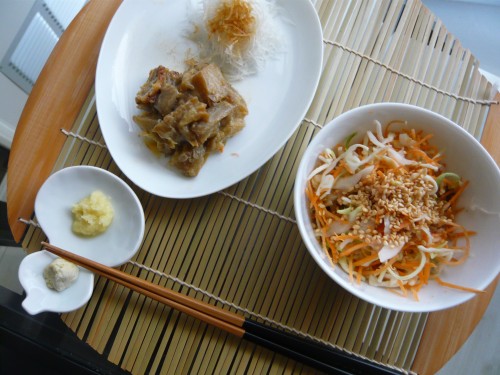
Find the location of a particular element. This screenshot has height=375, width=500. chopsticks is located at coordinates (233, 313), (238, 332).